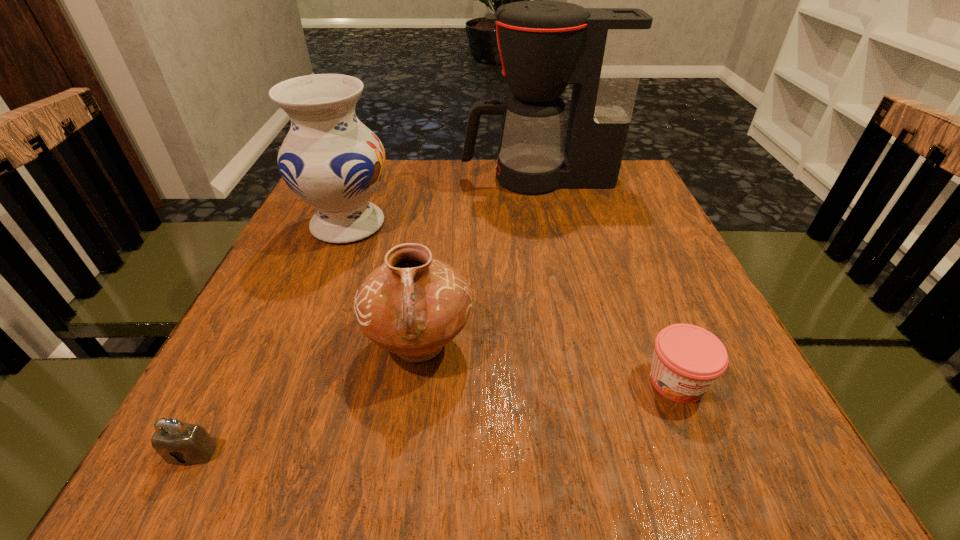
What are the coordinates of `vacant point located between the jam and the third shortest object` in the screenshot? It's located at (548, 363).

The width and height of the screenshot is (960, 540). Identify the location of empty space between the jam and the farthest object. (607, 280).

Find the location of a particular element. The image size is (960, 540). free space that is in between the coffee maker and the vase is located at coordinates (443, 201).

Locate an element on the screen. free point between the jam and the fourth shortest object is located at coordinates (513, 303).

At what (x,y) coordinates should I click in order to perform the action: click on free spot between the jam and the padlock. Please return your answer as a coordinate pair (x, y). Looking at the image, I should click on (434, 417).

The image size is (960, 540). I want to click on the fourth closest object to the jam, so click(179, 443).

Identify the location of object that is the second nearest to the padlock. (333, 162).

This screenshot has width=960, height=540. In order to click on vacant point that satisfies the following two spatial constraints: 1. pour from the carafe of the farthest object; 2. on the front side of the vase in this screenshot , I will do `click(546, 225)`.

This screenshot has height=540, width=960. Find the location of `vacant point that satisfies the following two spatial constraints: 1. pour from the carafe of the tallest object; 2. at the front of the nearest object near the keyhole`. vacant point that satisfies the following two spatial constraints: 1. pour from the carafe of the tallest object; 2. at the front of the nearest object near the keyhole is located at coordinates [592, 453].